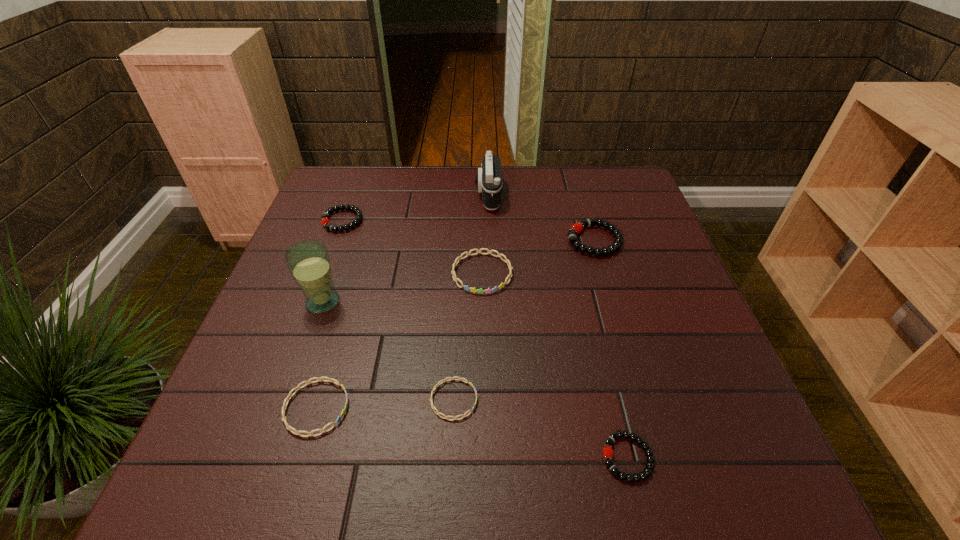
Where is `blue glass`? This screenshot has width=960, height=540. blue glass is located at coordinates (308, 261).

Identify the location of glass. The image size is (960, 540). (308, 261).

The width and height of the screenshot is (960, 540). I want to click on camera, so click(x=489, y=177).

This screenshot has height=540, width=960. Identify the location of the biggest black bracelet. (577, 227).

I want to click on the farthest blue bracelet, so click(x=507, y=261).

At what (x,y) coordinates should I click in order to perform the action: click on the second biggest black bracelet. Please return your answer as a coordinate pair (x, y). Looking at the image, I should click on (325, 221).

At what (x,y) coordinates should I click in order to perform the action: click on the leftmost blue bracelet. Please return your answer as a coordinate pair (x, y). This screenshot has width=960, height=540. Looking at the image, I should click on (333, 380).

This screenshot has height=540, width=960. I want to click on the nearest black bracelet, so click(607, 451).

The width and height of the screenshot is (960, 540). Find the location of `the shortest bracelet`. the shortest bracelet is located at coordinates (451, 378).

Identify the location of the shortest object. (451, 378).